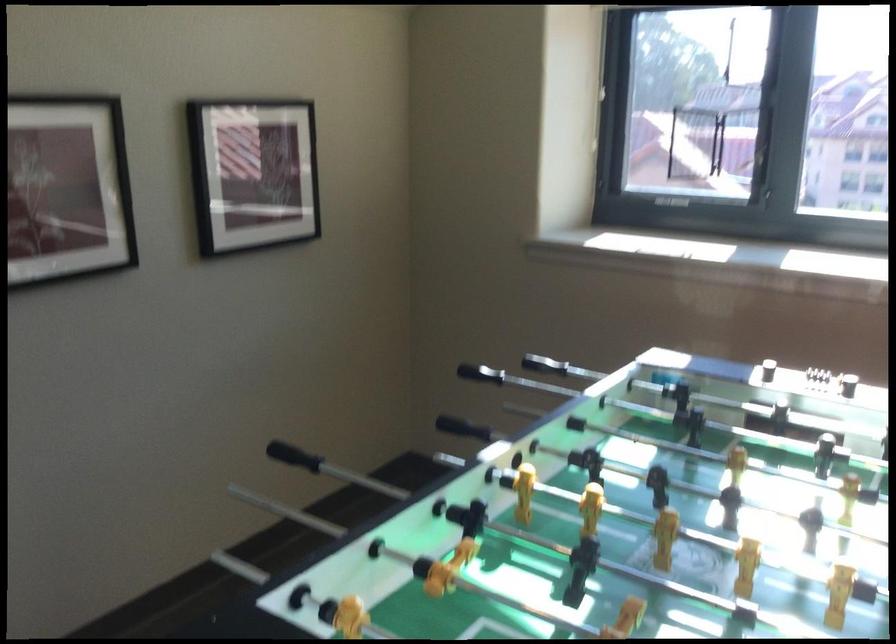
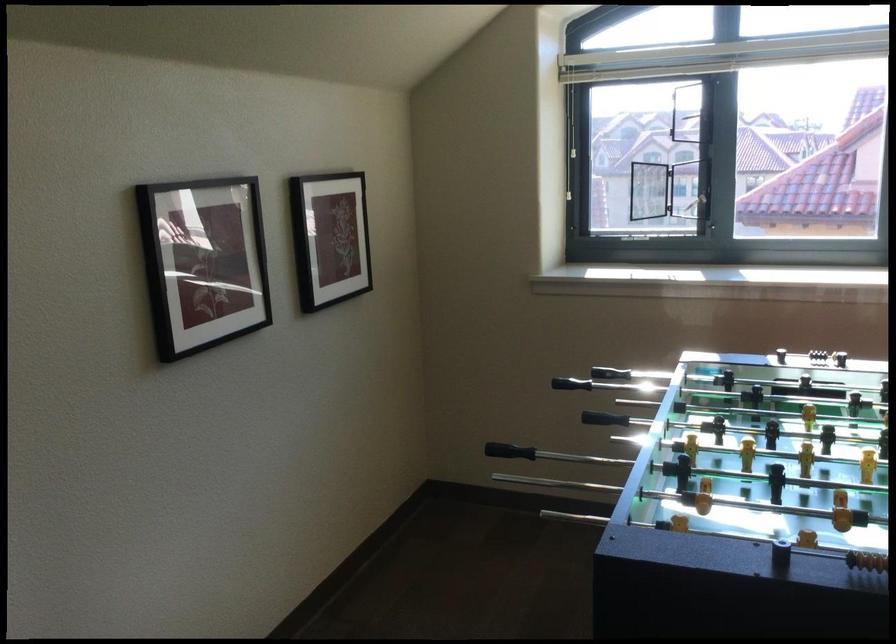
Locate, in the second image, the point that corresponds to point (737, 156) in the first image.

(688, 189)